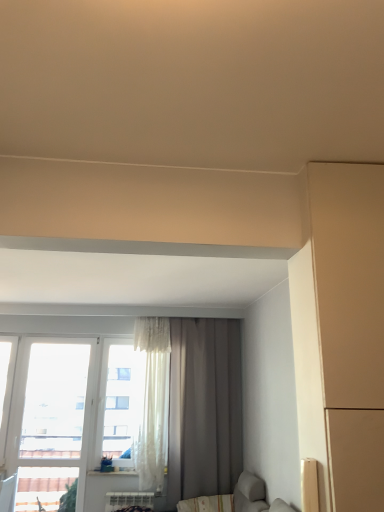
This screenshot has height=512, width=384. Describe the element at coordinates (204, 408) in the screenshot. I see `gray matte curtain at center` at that location.

Where is `gray matte curtain at center`? gray matte curtain at center is located at coordinates (204, 408).

Measure the distance between point (46,375) and camera.

4.85 meters.

Describe the element at coordinates (50, 419) in the screenshot. I see `transparent glass window at left` at that location.

Find the location of `transparent glass window at left`. transparent glass window at left is located at coordinates pyautogui.click(x=50, y=419).

The height and width of the screenshot is (512, 384). What are the coordinates of `gray matte curtain at center` in the screenshot? It's located at (204, 408).

Can you confirm if gray matte curtain at center is positioned to the right of transparent glass window at left?

Yes.

Considering the relative positions of gray matte curtain at center and transparent glass window at left in the image provided, is gray matte curtain at center in front of transparent glass window at left?

That is True.

Is point (207, 437) closer to viewer compared to point (57, 389)?

Yes, point (207, 437) is in front of point (57, 389).

From the image's perspective, between gray matte curtain at center and transparent glass window at left, who is located below?

transparent glass window at left is shown below in the image.

From a real-world perspective, is gray matte curtain at center above or below transparent glass window at left?

gray matte curtain at center is above transparent glass window at left.

Between gray matte curtain at center and transparent glass window at left, which one has larger width?

gray matte curtain at center is wider.

Considering the sizes of objects gray matte curtain at center and transparent glass window at left in the image provided, who is shorter, gray matte curtain at center or transparent glass window at left?

Standing shorter between the two is transparent glass window at left.

Who is smaller, gray matte curtain at center or transparent glass window at left?

Smaller between the two is transparent glass window at left.

Would you say gray matte curtain at center is outside transparent glass window at left?

Yes, gray matte curtain at center is located beyond the bounds of transparent glass window at left.

Consider the image. Is gray matte curtain at center not near transparent glass window at left?

gray matte curtain at center is far away from transparent glass window at left.

Is gray matte curtain at center turned away from transparent glass window at left?

gray matte curtain at center is not turned away from transparent glass window at left.

At what (x,y) coordinates should I click in order to perform the action: click on window behind the gray matte curtain at center. Please return your answer as a coordinate pair (x, y). Looking at the image, I should click on (50, 419).

Between transparent glass window at left and gray matte curtain at center, which one appears on the right side from the viewer's perspective?

Positioned to the right is gray matte curtain at center.

Considering the relative positions of transparent glass window at left and gray matte curtain at center in the image provided, is transparent glass window at left in front of gray matte curtain at center?

No, transparent glass window at left is further to the viewer.

Between point (70, 382) and point (178, 451), which one is positioned behind?

Point (70, 382)

From the image's perspective, is transparent glass window at left above or below gray matte curtain at center?

From the image's perspective, transparent glass window at left appears below gray matte curtain at center.

From a real-world perspective, who is located lower, transparent glass window at left or gray matte curtain at center?

transparent glass window at left is physically lower.

Considering the sizes of transparent glass window at left and gray matte curtain at center in the image, is transparent glass window at left wider or thinner than gray matte curtain at center?

transparent glass window at left is thinner than gray matte curtain at center.

Considering the relative sizes of transparent glass window at left and gray matte curtain at center in the image provided, is transparent glass window at left taller than gray matte curtain at center?

In fact, transparent glass window at left may be shorter than gray matte curtain at center.

Consider the image. Considering the sizes of objects transparent glass window at left and gray matte curtain at center in the image provided, who is bigger, transparent glass window at left or gray matte curtain at center?

Bigger between the two is gray matte curtain at center.

From the picture: Do you think transparent glass window at left is within gray matte curtain at center, or outside of it?

transparent glass window at left is spatially situated outside gray matte curtain at center.

Is transparent glass window at left next to gray matte curtain at center and touching it?

transparent glass window at left is not next to gray matte curtain at center, and they're not touching.

Is transparent glass window at left facing towards gray matte curtain at center?

No.

How many degrees apart are the facing directions of transparent glass window at left and gray matte curtain at center?

The facing directions of transparent glass window at left and gray matte curtain at center are 0.433 degrees apart.

At what (x,y) coordinates should I click in order to perform the action: click on window behind the gray matte curtain at center. Please return your answer as a coordinate pair (x, y). Looking at the image, I should click on (50, 419).

Where is `curtain in front of the transparent glass window at left`? The width and height of the screenshot is (384, 512). curtain in front of the transparent glass window at left is located at coordinates tap(204, 408).

At what (x,y) coordinates should I click in order to perform the action: click on window that appears below the gray matte curtain at center (from a real-world perspective). Please return your answer as a coordinate pair (x, y). The height and width of the screenshot is (512, 384). Looking at the image, I should click on (50, 419).